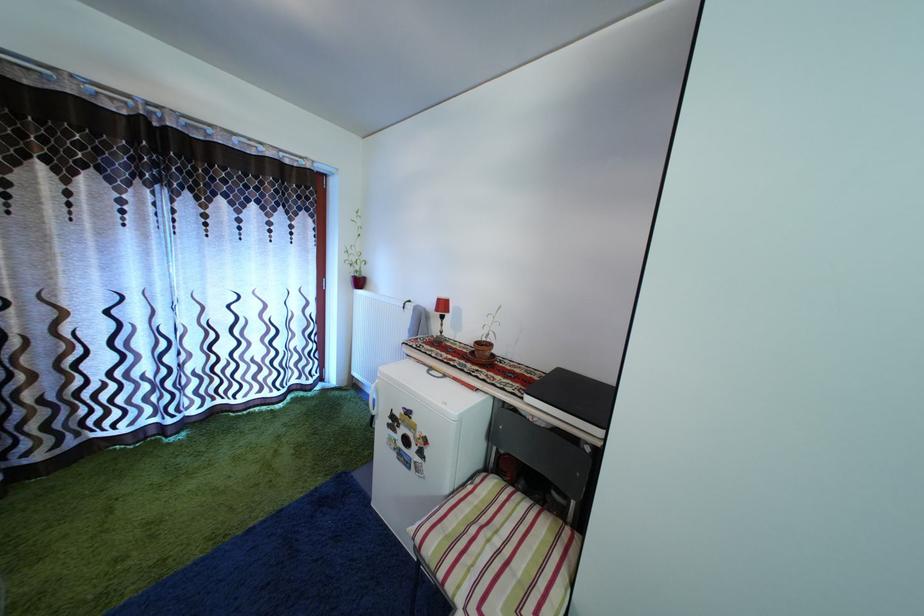
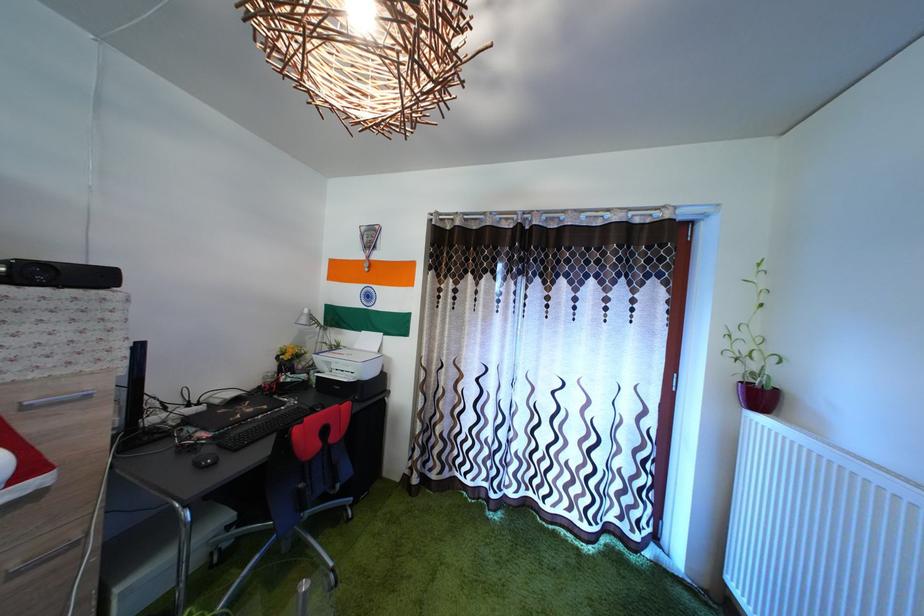
Question: The first image is from the beginning of the video and the second image is from the end. How did the camera likely rotate when shooting the video?

Choices:
 (A) Left
 (B) Right
 (C) Up
 (D) Down

Answer: (A)